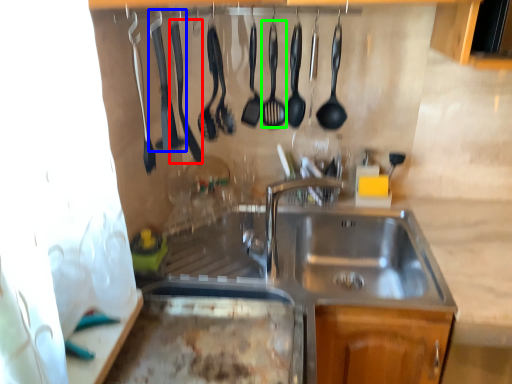
Question: Considering the real-world distances, which object is closest to silverware (highlighted by a red box)? silverware (highlighted by a blue box) or utensil (highlighted by a green box).

Choices:
 (A) silverware
 (B) utensil

Answer: (A)